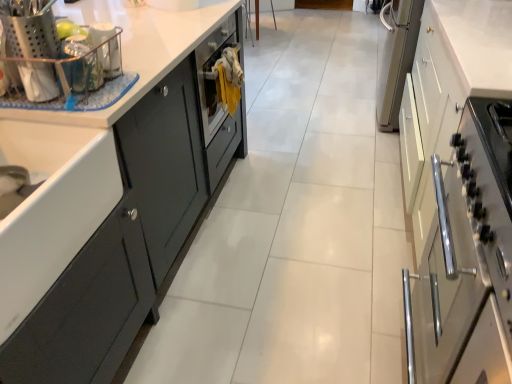
Question: From the image's perspective, would you say metallic silver utensil holder at upper left, which is the 1th appliance in front-to-back order, is positioned over satin white cabinet at right, the first cabinetry in the right-to-left sequence?

Choices:
 (A) no
 (B) yes

Answer: (B)

Question: Is metallic silver utensil holder at upper left, which is the second appliance in back-to-front order, touching satin white cabinet at right, the first cabinetry in the right-to-left sequence?

Choices:
 (A) no
 (B) yes

Answer: (A)

Question: Is metallic silver utensil holder at upper left, which is counted as the 1th appliance, starting from the left, behind satin white cabinet at right, the first cabinetry in the right-to-left sequence?

Choices:
 (A) no
 (B) yes

Answer: (A)

Question: Is metallic silver utensil holder at upper left, which is counted as the 1th appliance, starting from the left, not inside satin white cabinet at right, the first cabinetry in the right-to-left sequence?

Choices:
 (A) yes
 (B) no

Answer: (A)

Question: From the image's perspective, is metallic silver utensil holder at upper left, which is counted as the 1th appliance, starting from the left, below satin white cabinet at right, the first cabinetry in the right-to-left sequence?

Choices:
 (A) no
 (B) yes

Answer: (A)

Question: From a real-world perspective, is metallic silver utensil holder at upper left, which is counted as the 1th appliance, starting from the left, physically below satin white cabinet at right, which is the second cabinetry in left-to-right order?

Choices:
 (A) no
 (B) yes

Answer: (A)

Question: Is matte dark gray cabinet at left, the 2th cabinetry positioned from the right, beside satin white cabinet at right, which is the second cabinetry in left-to-right order?

Choices:
 (A) no
 (B) yes

Answer: (A)

Question: Does matte dark gray cabinet at left, which ranks as the 1th cabinetry in left-to-right order, have a lesser height compared to satin white cabinet at right, which is the second cabinetry in left-to-right order?

Choices:
 (A) yes
 (B) no

Answer: (A)

Question: Does matte dark gray cabinet at left, which ranks as the 1th cabinetry in left-to-right order, have a greater width compared to satin white cabinet at right, the first cabinetry in the right-to-left sequence?

Choices:
 (A) yes
 (B) no

Answer: (A)

Question: Considering the relative positions of matte dark gray cabinet at left, which ranks as the 1th cabinetry in left-to-right order, and satin white cabinet at right, which is the second cabinetry in left-to-right order, in the image provided, is matte dark gray cabinet at left, which ranks as the 1th cabinetry in left-to-right order, to the left of satin white cabinet at right, which is the second cabinetry in left-to-right order, from the viewer's perspective?

Choices:
 (A) yes
 (B) no

Answer: (A)

Question: Is matte dark gray cabinet at left, the 2th cabinetry positioned from the right, positioned beyond the bounds of satin white cabinet at right, the first cabinetry in the right-to-left sequence?

Choices:
 (A) yes
 (B) no

Answer: (A)

Question: Is matte dark gray cabinet at left, which ranks as the 1th cabinetry in left-to-right order, smaller than satin white cabinet at right, which is the second cabinetry in left-to-right order?

Choices:
 (A) yes
 (B) no

Answer: (A)

Question: Is white glossy countertop at center beside satin white cabinet at right, which is the second cabinetry in left-to-right order?

Choices:
 (A) yes
 (B) no

Answer: (B)